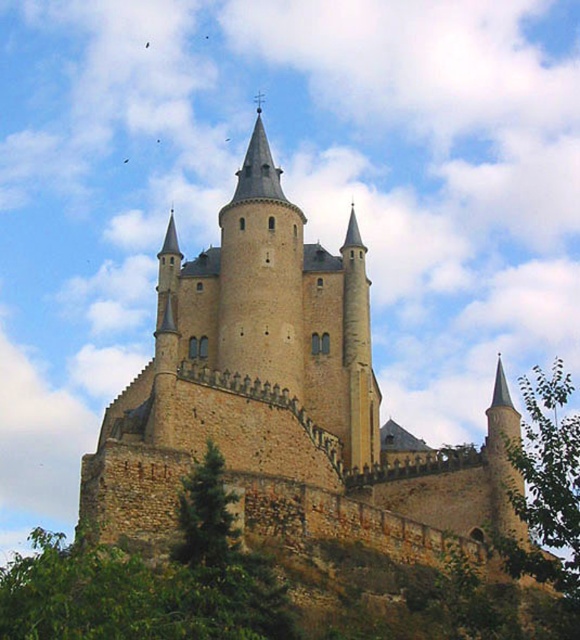
You are a knight standing at the base of the beige stone castle at center. You notice a green leafy tree at right in the distance. Which object is higher in elevation?

The beige stone castle at center is positioned over the green leafy tree at right, so the beige stone castle at center is higher in elevation.

In the scene shown: You are a medieval architect planning to build a new tower adjacent to the beige stone castle at center. Given the castle is positioned at coordinates approximately 0.617 along the x and 0.497 along the y axis, where would you place the new tower to maintain symmetry with the existing central tower?

To maintain symmetry with the beige stone castle at center, the new tower should be placed at coordinates that mirror the central tower. Since the castle is at point (288, 394), the new tower should be positioned symmetrically opposite to the central tower within the same coordinate system.

You are a knight standing at the base of the beige stone castle at center and want to hide behind the green leafy tree at right to avoid detection. Given their sizes, will the tree be large enough to conceal you from someone watching from the tallest tower?

The beige stone castle at center is larger than the green leafy tree at right, so the tree may not be large enough to fully conceal you from the watchful eyes in the tallest tower.